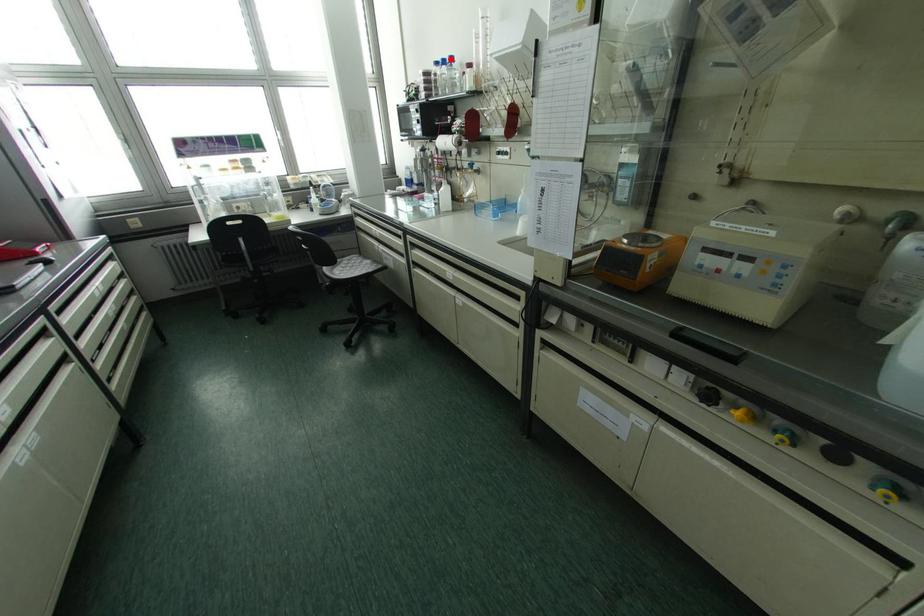
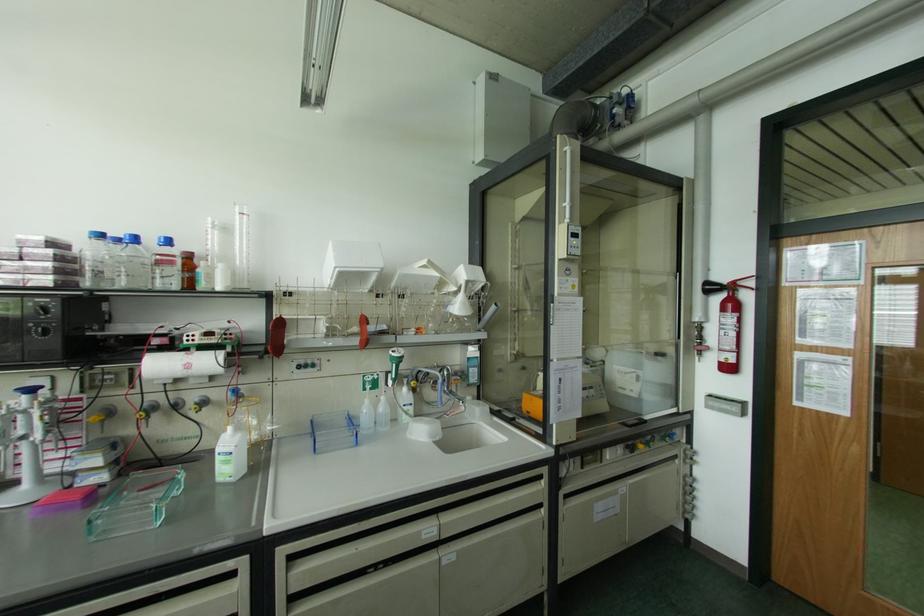
Locate, in the second image, the point that corresponds to the highlighted location in the first image.

(167, 241)